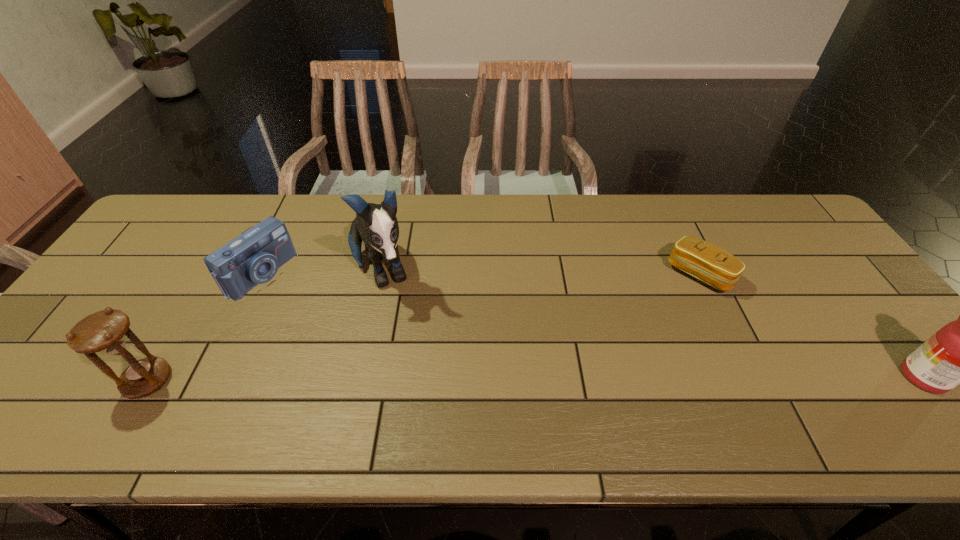
Identify which object is the second nearest to the hourglass. Please provide its 2D coordinates. Your answer should be formatted as a tuple, i.e. [(x, y)], where the tuple contains the x and y coordinates of a point satisfying the conditions above.

[(376, 224)]

At what (x,y) coordinates should I click in order to perform the action: click on object that is the fourth closest one to the camera. Please return your answer as a coordinate pair (x, y). The image size is (960, 540). Looking at the image, I should click on (959, 353).

Where is `vacant region that satisfies the following two spatial constraints: 1. on the front side of the fruit juice; 2. on the label of the shortest object`? The image size is (960, 540). vacant region that satisfies the following two spatial constraints: 1. on the front side of the fruit juice; 2. on the label of the shortest object is located at coordinates [749, 377].

Where is `free space that satisfies the following two spatial constraints: 1. on the front side of the rightmost object; 2. on the label of the third object from right to left`? This screenshot has height=540, width=960. free space that satisfies the following two spatial constraints: 1. on the front side of the rightmost object; 2. on the label of the third object from right to left is located at coordinates (359, 377).

Where is `free spot that satisfies the following two spatial constraints: 1. on the front side of the fourth tallest object; 2. on the left side of the clutch bag`? free spot that satisfies the following two spatial constraints: 1. on the front side of the fourth tallest object; 2. on the left side of the clutch bag is located at coordinates (260, 274).